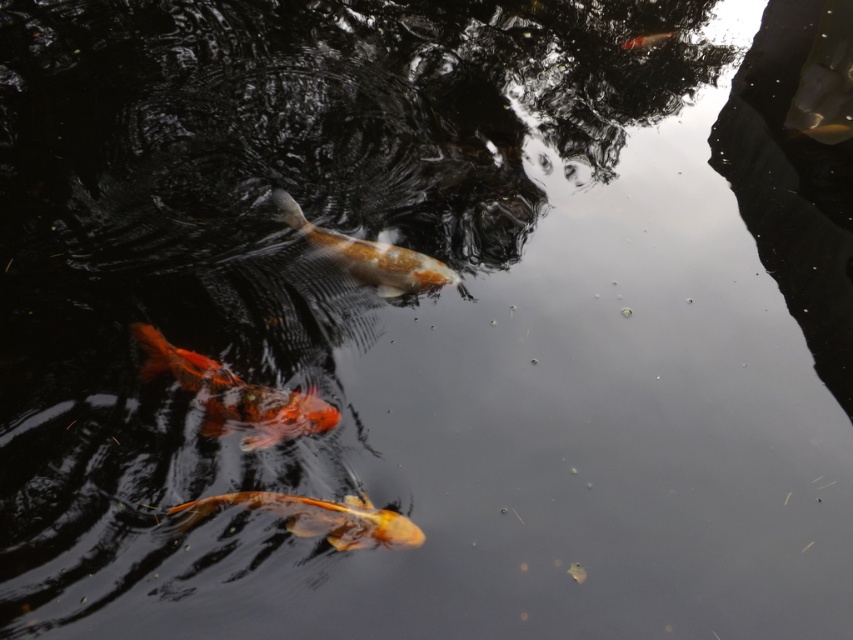
You are an underwater photographer aiming to capture the shiny orange fish at center and the shiny orange fish at upper right. Since you want to focus on the larger fish, which one should you aim your camera at?

The shiny orange fish at center has a greater height compared to the shiny orange fish at upper right, so you should aim your camera at the shiny orange fish at center to focus on the larger fish.

From the picture: You are a photographer trying to capture the shiny orange fish at lower left and the shiny orange goldfish at lower center in the pond. Which fish should you focus on first if you want to photograph the larger one?

The shiny orange fish at lower left is bigger than the shiny orange goldfish at lower center, so you should focus on the shiny orange fish at lower left first.